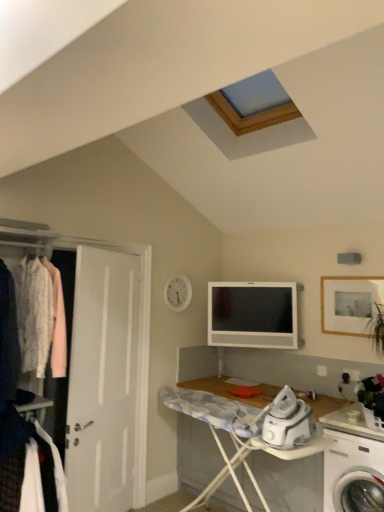
Describe the element at coordinates (107, 382) in the screenshot. I see `white matte door at left` at that location.

Identify the location of satin silver television at center. The height and width of the screenshot is (512, 384). pos(253,315).

Image resolution: width=384 pixels, height=512 pixels. In order to click on white fabric clothes at left in this screenshot , I will do [22, 429].

What's the angular difference between satin silver television at center and wooden ironing board at lower center's facing directions?

satin silver television at center and wooden ironing board at lower center are facing 36.2 degrees away from each other.

Is the surface of satin silver television at center in direct contact with wooden ironing board at lower center?

No, satin silver television at center is not in contact with wooden ironing board at lower center.

Considering the relative sizes of satin silver television at center and wooden ironing board at lower center in the image provided, is satin silver television at center smaller than wooden ironing board at lower center?

Yes, satin silver television at center is smaller than wooden ironing board at lower center.

At what (x,y) coordinates should I click in order to perform the action: click on closet to the left of white fabric at left. Please return your answer as a coordinate pair (x, y). Looking at the image, I should click on (22, 429).

Is white fabric at left positioned far away from white fabric clothes at left?

white fabric at left is actually quite close to white fabric clothes at left.

Does white fabric at left have a lesser height compared to white fabric clothes at left?

Correct, white fabric at left is not as tall as white fabric clothes at left.

Does white matte door at left turn towards white plastic washing machine at lower right?

No, white matte door at left does not turn towards white plastic washing machine at lower right.

Is white matte door at left positioned beyond the bounds of white plastic washing machine at lower right?

white matte door at left lies outside white plastic washing machine at lower right's area.

From the image's perspective, which one is positioned lower, white matte door at left or white plastic washing machine at lower right?

white plastic washing machine at lower right, from the image's perspective.

Which of these two, white matte door at left or wooden ironing board at lower center, stands taller?

Standing taller between the two is white matte door at left.

Is point (89, 485) closer to viewer compared to point (218, 408)?

No, (89, 485) is behind (218, 408).

Is white matte door at left positioned before wooden ironing board at lower center?

No, white matte door at left is further to the viewer.

Looking at their sizes, would you say satin silver television at center is wider or thinner than wooden framed photo at upper right?

In the image, satin silver television at center appears to be wider than wooden framed photo at upper right.

Is satin silver television at center in front of wooden framed photo at upper right?

No, it is not.

From a real-world perspective, which is physically above, satin silver television at center or wooden framed photo at upper right?

wooden framed photo at upper right is physically above.

Which point is more distant from viewer, (294, 291) or (344, 304)?

The point (294, 291) is farther from the camera.

Does white fabric at left come in front of white matte door at left?

Yes, white fabric at left is closer to the viewer.

Between white fabric at left and white matte door at left, which one has more height?

white matte door at left is taller.

Identify the location of clothing below the white matte door at left (from a real-world perspective). The height and width of the screenshot is (512, 384). (29, 467).

Would you say white fabric at left is outside white matte door at left?

Yes, white fabric at left is not within white matte door at left.

Between wooden ironing board at lower center and satin silver television at center, which one appears on the left side from the viewer's perspective?

Positioned to the left is wooden ironing board at lower center.

Can you confirm if wooden ironing board at lower center is taller than satin silver television at center?

Yes, wooden ironing board at lower center is taller than satin silver television at center.

From the image's perspective, would you say wooden ironing board at lower center is shown under satin silver television at center?

Indeed, from the image's perspective, wooden ironing board at lower center is shown beneath satin silver television at center.

You are a GUI agent. You are given a task and a screenshot of the screen. Output one action in this format:
    pyautogui.click(x=<x>, y=<y>)
    Task: Click on the desk located underneath the satin silver television at center (from a real-world perspective)
    The image size is (384, 512).
    Given the screenshot: What is the action you would take?
    pyautogui.click(x=249, y=432)

Where is `clothing that appears in front of the white fabric clothes at left`? Image resolution: width=384 pixels, height=512 pixels. clothing that appears in front of the white fabric clothes at left is located at coordinates (29, 467).

From the image, which object appears to be farther from white plastic washing machine at lower right, wooden framed photo at upper right or wooden ironing board at lower center?

wooden framed photo at upper right is further to white plastic washing machine at lower right.

Looking at the image, which one is located further to wooden ironing board at lower center, white plastic washing machine at lower right or white fabric at left?

The object further to wooden ironing board at lower center is white fabric at left.

Looking at the image, which one is located closer to wooden framed photo at upper right, white plastic washing machine at lower right or white matte door at left?

The object closer to wooden framed photo at upper right is white plastic washing machine at lower right.

When comparing their distances from wooden ironing board at lower center, does satin silver television at center or wooden framed photo at upper right seem further?

wooden framed photo at upper right.

When comparing their distances from wooden framed photo at upper right, does white fabric at left or white fabric clothes at left seem further?

white fabric clothes at left is further to wooden framed photo at upper right.

Based on their spatial positions, is white plastic washing machine at lower right or white matte door at left closer to white fabric clothes at left?

white matte door at left is positioned closer to the anchor white fabric clothes at left.

Looking at the image, which one is located closer to white fabric at left, satin silver television at center or white plastic washing machine at lower right?

white plastic washing machine at lower right is closer to white fabric at left.

Considering their positions, is wooden ironing board at lower center positioned further to white fabric at left than white matte door at left?

wooden ironing board at lower center.

Image resolution: width=384 pixels, height=512 pixels. In order to click on picture frame positioned between wooden ironing board at lower center and satin silver television at center from near to far in this screenshot , I will do `click(350, 304)`.

Identify the location of door located between white fabric at left and wooden framed photo at upper right in the left-right direction. The width and height of the screenshot is (384, 512). (107, 382).

Where is `desk between white fabric clothes at left and wooden framed photo at upper right`? desk between white fabric clothes at left and wooden framed photo at upper right is located at coordinates (249, 432).

The height and width of the screenshot is (512, 384). In order to click on closet positioned between white fabric at left and white matte door at left from near to far in this screenshot , I will do `click(22, 429)`.